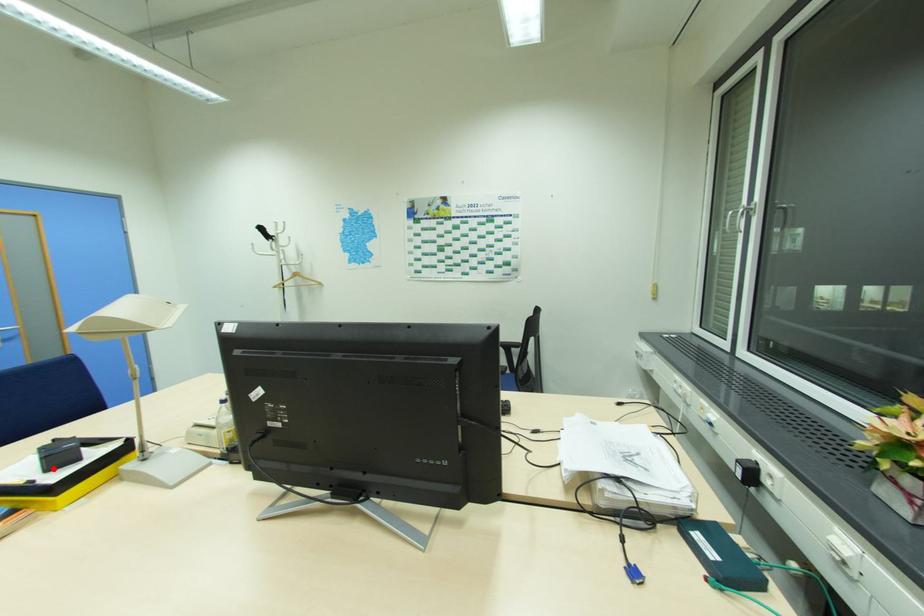
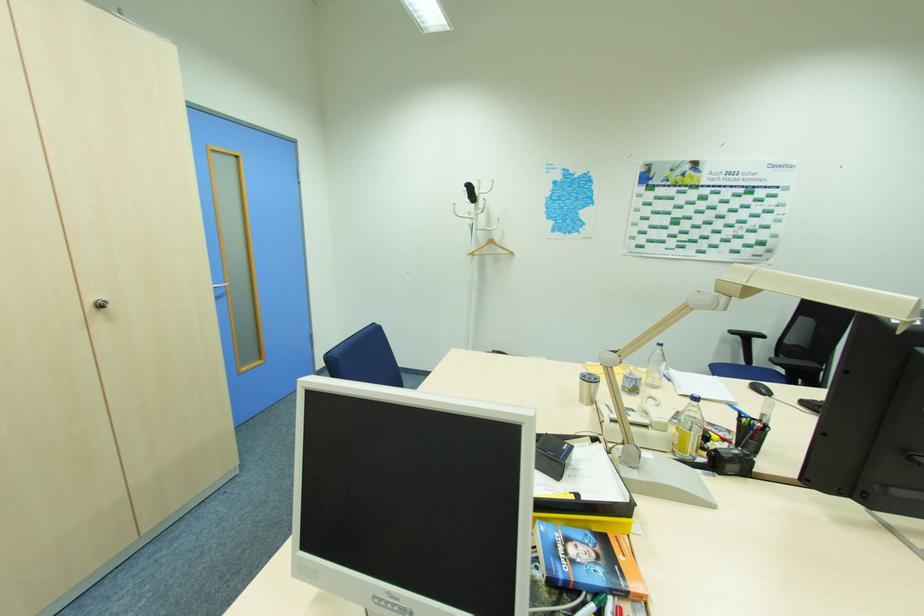
Question: I am providing you with two images of the same scene from different viewpoints. Given a red point in image1, look at the same physical point in image2. Is it:

Choices:
 (A) Closer to the viewpoint
 (B) Farther from the viewpoint

Answer: (B)